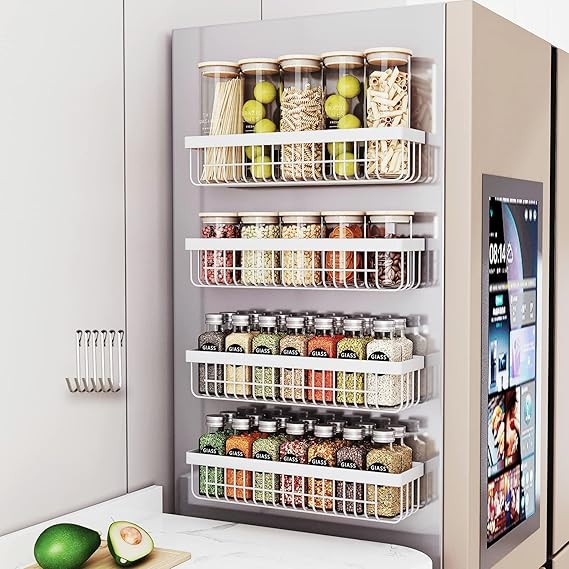
Identify the location of metal hooks. The image size is (569, 569). (70, 384), (79, 387), (85, 384), (94, 384), (105, 387), (116, 387).